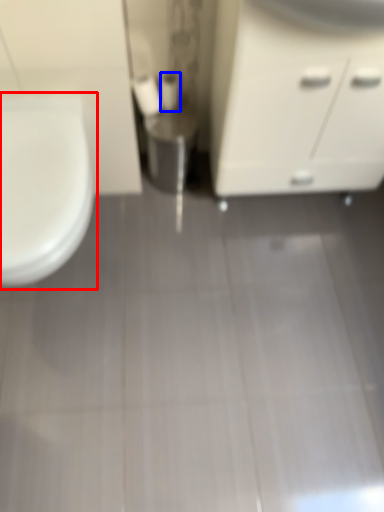
Question: Which object is closer to the camera taking this photo, toilet (highlighted by a red box) or toilet paper (highlighted by a blue box)?

Choices:
 (A) toilet
 (B) toilet paper

Answer: (A)